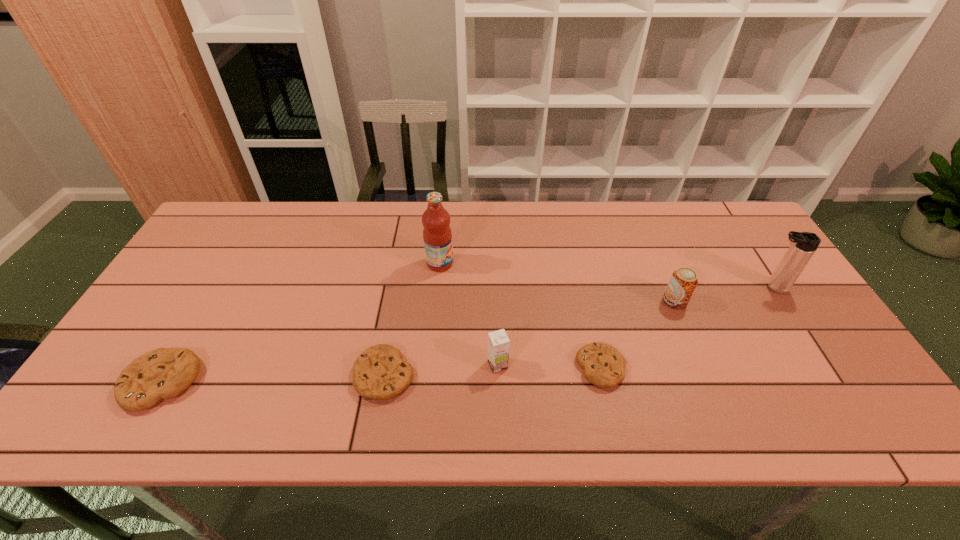
Locate an element on the screen. The height and width of the screenshot is (540, 960). chocolate milk is located at coordinates (498, 342).

The image size is (960, 540). I want to click on vacant region located on the back of the leftmost object, so click(x=221, y=281).

The width and height of the screenshot is (960, 540). Find the location of `vacant space located 0.270m on the back of the second cookie from left to right`. vacant space located 0.270m on the back of the second cookie from left to right is located at coordinates (402, 273).

Identify the location of vacant point located 0.300m on the back of the shortest cookie. (577, 264).

This screenshot has width=960, height=540. I want to click on vacant space located on the handle side of the thermos bottle, so click(x=630, y=287).

Find the location of a particular element. The width and height of the screenshot is (960, 540). vacant space situated 0.080m on the handle side of the thermos bottle is located at coordinates (729, 287).

Locate an element on the screen. This screenshot has width=960, height=540. vacant space located 0.340m on the handle side of the thermos bottle is located at coordinates (636, 287).

You are a GUI agent. You are given a task and a screenshot of the screen. Output one action in this format:
    pyautogui.click(x=<x>, y=<y>)
    Task: Click on the vacant space positioned 0.400m on the back of the second object from right to left
    The height and width of the screenshot is (540, 960).
    Given the screenshot: What is the action you would take?
    point(636,207)

This screenshot has height=540, width=960. Identify the location of vacant region located 0.180m on the front label of the fruit juice. (514, 264).

Where is `free spot located 0.240m on the right of the fourth object from right to left`? This screenshot has height=540, width=960. free spot located 0.240m on the right of the fourth object from right to left is located at coordinates 608,365.